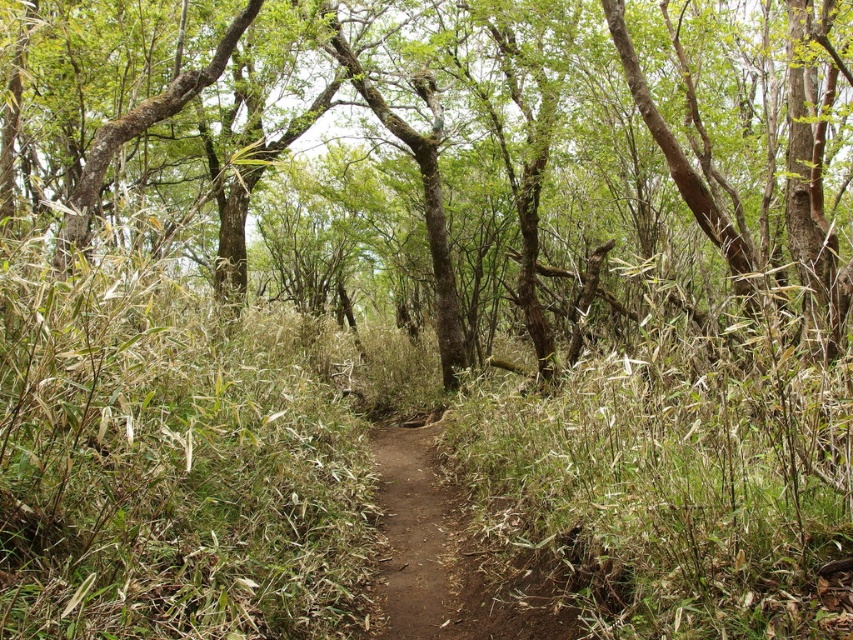
From the picture: You are a hiker who wants to take a shortcut through the forest. You see a green bark tree at center and a brown dirt path at center. Which one is closer to you?

The brown dirt path at center is closer because the green bark tree at center is 20.67 feet away from it, meaning the path is nearer to your current position.

You are a hiker trying to follow the brown dirt path at center through the forest. As you walk, you notice a green bark tree at center blocking your way. Which direction should you go around it to stay on the path?

The green bark tree at center is in front of the brown dirt path at center, so you should go around it either to the left or right to stay on the path.

You are a hiker trying to determine the best route through the forest. You notice a green bark tree at center and a brown dirt path at center. Which object is taller and could potentially block your view ahead?

The green bark tree at center is taller than the brown dirt path at center, so it could potentially block your view ahead.